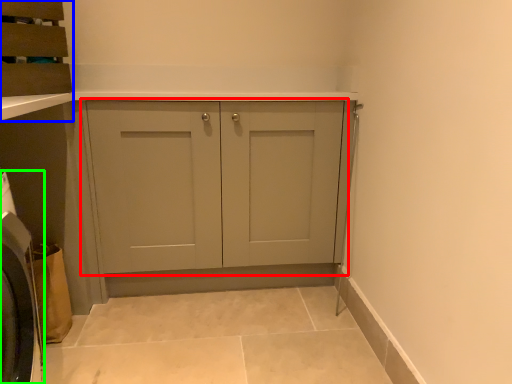
Question: Which object is the farthest from cupboard (highlighted by a red box)? Choose among these: cabinetry (highlighted by a blue box) or washing machine (highlighted by a green box).

Choices:
 (A) cabinetry
 (B) washing machine

Answer: (B)